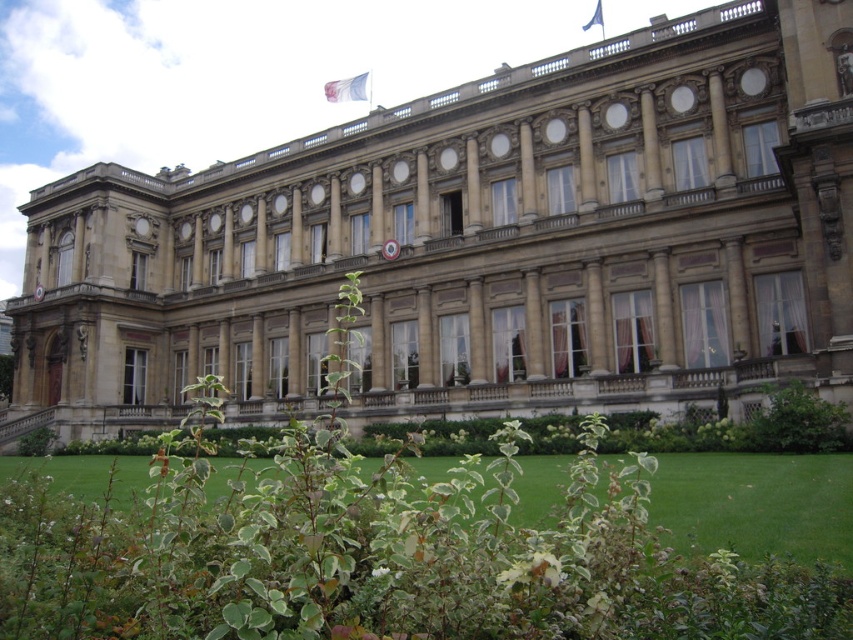
How much distance is there between beige stone building at center and green leafy bush at lower right?

A distance of 154.68 feet exists between beige stone building at center and green leafy bush at lower right.

Can you confirm if beige stone building at center is smaller than green leafy bush at lower right?

No.

Identify the location of beige stone building at center. (477, 243).

Can you confirm if green grass at lower center is positioned to the left of green leafy bush at lower right?

Indeed, green grass at lower center is positioned on the left side of green leafy bush at lower right.

Which is above, green grass at lower center or green leafy bush at lower right?

green leafy bush at lower right

Which is in front, point (746, 531) or point (747, 426)?

Point (746, 531) is more forward.

This screenshot has height=640, width=853. I want to click on green grass at lower center, so click(757, 502).

Who is lower down, green leafy bush at lower right or green leafy bush at lower left?

Positioned lower is green leafy bush at lower left.

Is point (788, 444) farther from camera compared to point (49, 436)?

No, (788, 444) is in front of (49, 436).

Identify the location of green leafy bush at lower right. The image size is (853, 640). (798, 422).